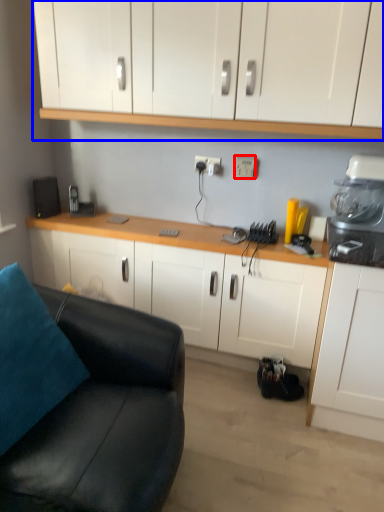
Question: Among these objects, which one is farthest to the camera, electric outlet (highlighted by a red box) or cabinetry (highlighted by a blue box)?

Choices:
 (A) electric outlet
 (B) cabinetry

Answer: (A)